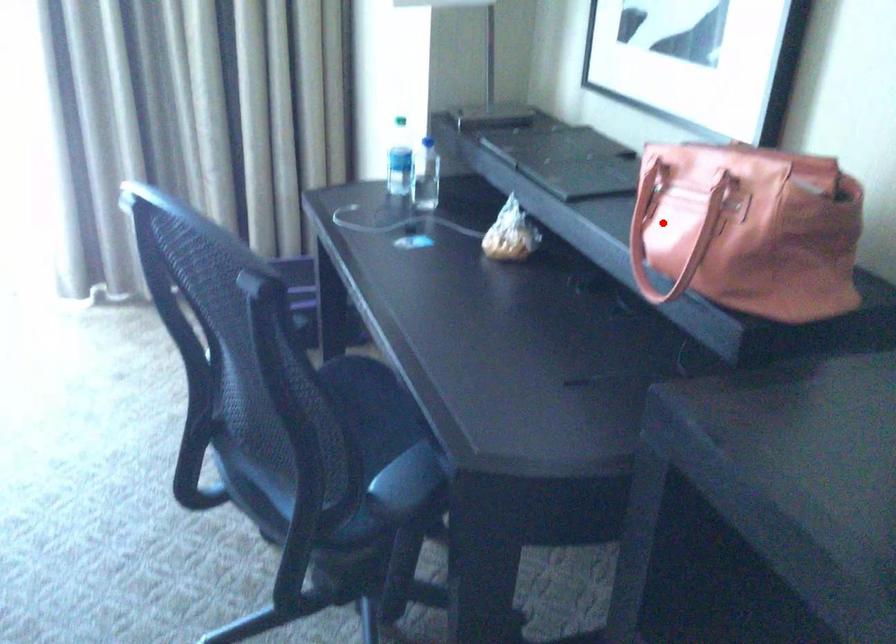
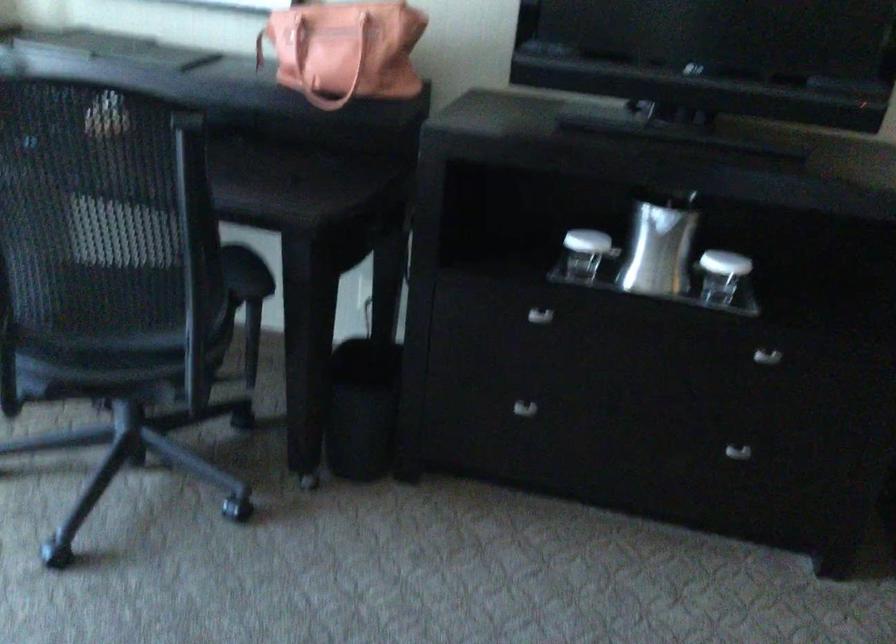
Locate, in the second image, the point that corresponds to the highlighted location in the first image.

(315, 57)